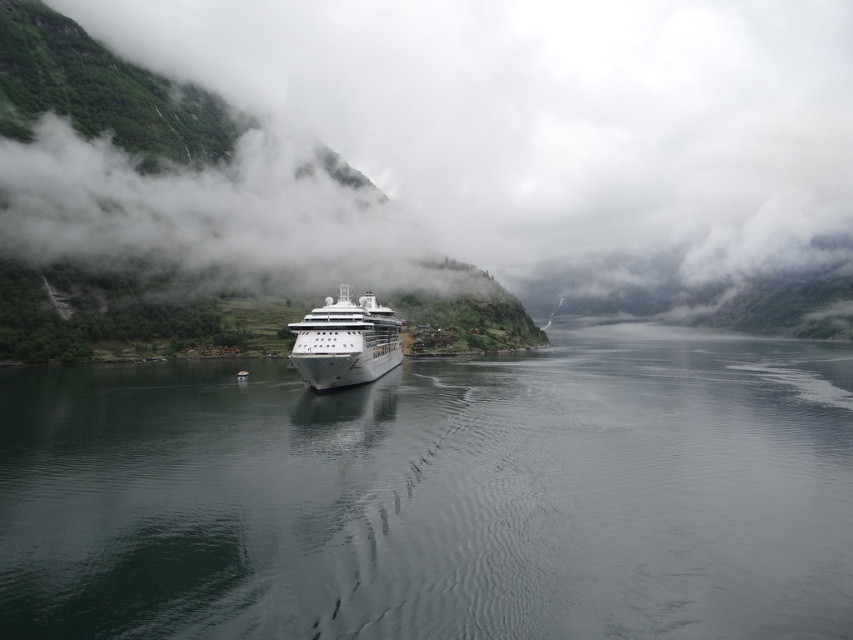
Question: Which point is closer to the camera?

Choices:
 (A) (660, 433)
 (B) (569, 26)

Answer: (A)

Question: Which of the following is the farthest from the observer?

Choices:
 (A) (136, 628)
 (B) (328, 355)
 (C) (737, 179)

Answer: (C)

Question: From the image, what is the correct spatial relationship of dark gray water at center in relation to green matte cloud at center?

Choices:
 (A) left
 (B) right

Answer: (A)

Question: Can you confirm if dark gray water at center is positioned below white glossy cruise ship at center?

Choices:
 (A) no
 (B) yes

Answer: (B)

Question: From the image, what is the correct spatial relationship of dark gray water at center in relation to white glossy cruise ship at center?

Choices:
 (A) above
 (B) below

Answer: (B)

Question: Which point is farther from the camera taking this photo?

Choices:
 (A) [x=433, y=22]
 (B) [x=157, y=456]
 (C) [x=305, y=323]

Answer: (A)